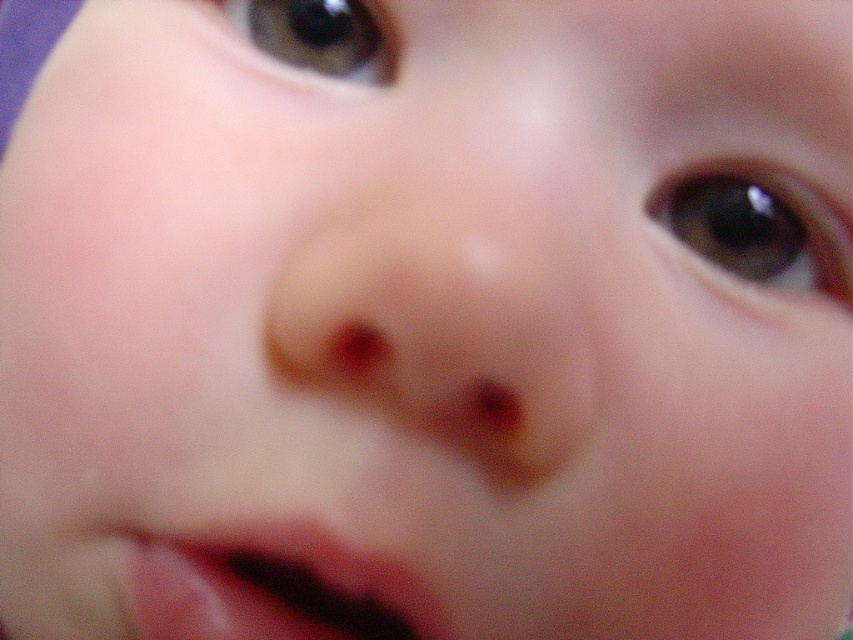
Question: Which of the following is the closest to the observer?

Choices:
 (A) (166, 625)
 (B) (347, 52)
 (C) (662, 211)

Answer: (A)

Question: From the image, what is the correct spatial relationship of pink smooth lips at lower center in relation to brown glossy eye at upper left?

Choices:
 (A) below
 (B) above

Answer: (A)

Question: Is brown glossy eye at upper right wider than brown glossy eye at upper left?

Choices:
 (A) no
 (B) yes

Answer: (B)

Question: Among these objects, which one is nearest to the camera?

Choices:
 (A) brown glossy eye at upper right
 (B) brown glossy eye at upper left
 (C) pink smooth lips at lower center

Answer: (C)

Question: Based on their relative distances, which object is nearer to the pink smooth lips at lower center?

Choices:
 (A) brown glossy eye at upper right
 (B) brown glossy eye at upper left

Answer: (A)

Question: Is pink smooth lips at lower center positioned in front of brown glossy eye at upper right?

Choices:
 (A) yes
 (B) no

Answer: (A)